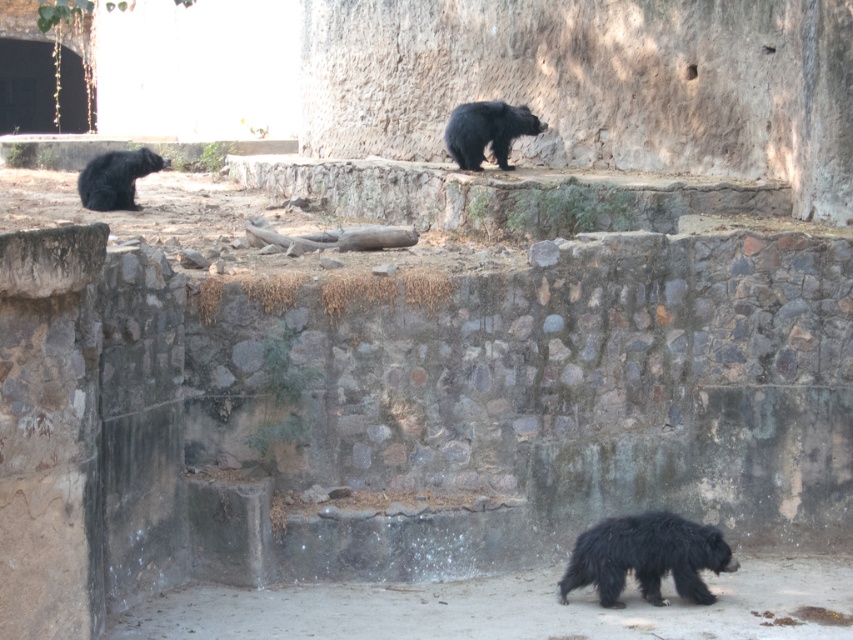
Which is in front, point (498, 140) or point (166, 163)?

Point (498, 140) is more forward.

Image resolution: width=853 pixels, height=640 pixels. In order to click on black fuzzy bear at upper center in this screenshot , I will do `click(486, 131)`.

Between shaggy black bear at lower center and shiny black bear at lower left, which one appears on the right side from the viewer's perspective?

Positioned to the right is shaggy black bear at lower center.

Is point (604, 592) closer to camera compared to point (129, 177)?

Yes, point (604, 592) is in front of point (129, 177).

The width and height of the screenshot is (853, 640). Identify the location of shaggy black bear at lower center. (646, 557).

Identify the location of shaggy black bear at lower center. This screenshot has height=640, width=853. (646, 557).

Does point (666, 531) lie behind point (468, 141)?

No, (666, 531) is closer to viewer.

What do you see at coordinates (646, 557) in the screenshot? The image size is (853, 640). I see `shaggy black bear at lower center` at bounding box center [646, 557].

Locate an element on the screen. This screenshot has height=640, width=853. shaggy black bear at lower center is located at coordinates [646, 557].